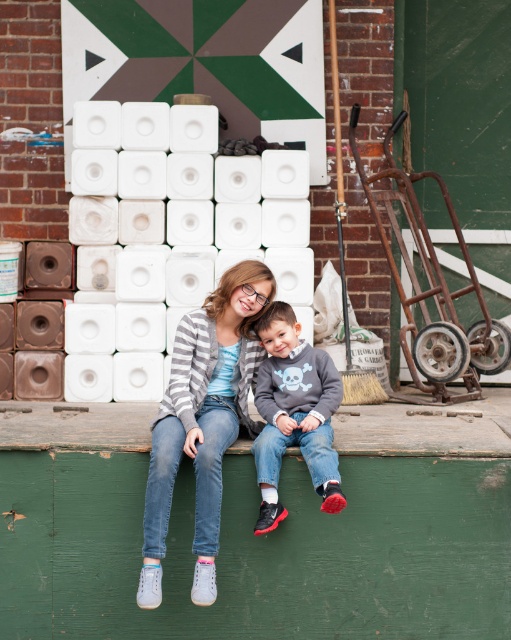
What is the exact coordinate of the white plastic toilet paper at center?

The white plastic toilet paper at center is located at point (200, 237).

You are a delivery person who needs to place a large package that is 1 meter wide. You see the white plastic toilet paper at center and the green wooden bench at lower center. Which object can the package fit next to without overlapping?

The white plastic toilet paper at center has a larger width than the green wooden bench at lower center, so the package can fit next to the white plastic toilet paper at center since it provides more space.